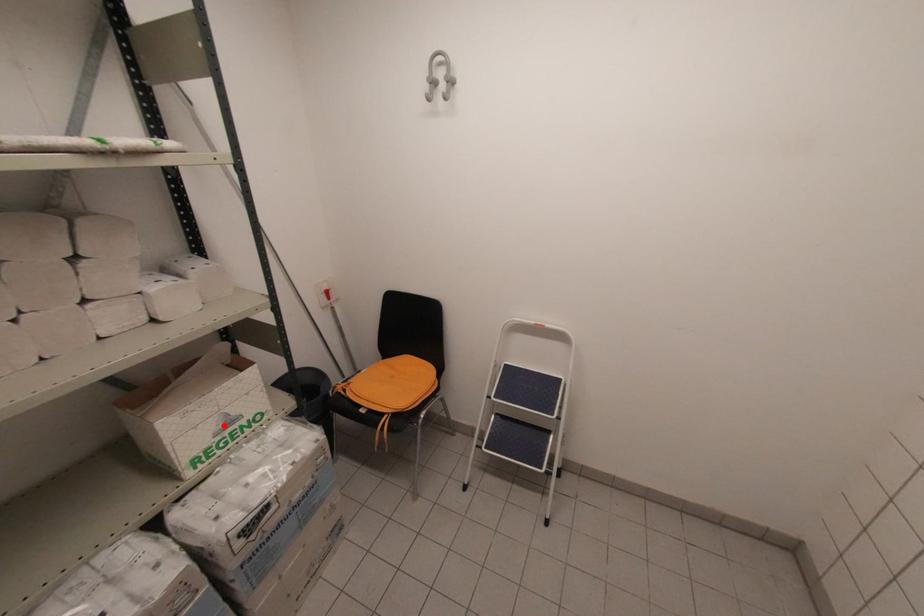
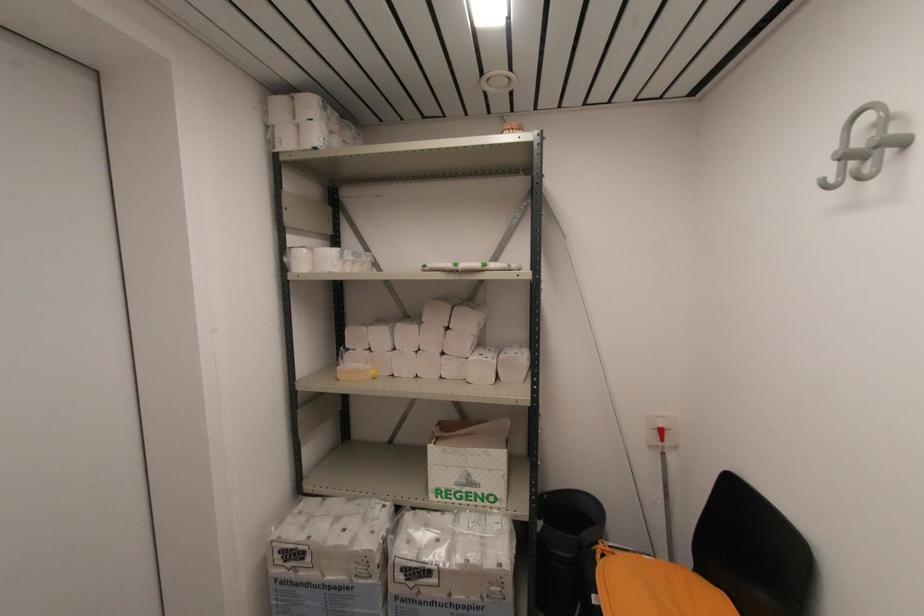
Question: I am providing you with two images of the same scene from different viewpoints. A red point is shown in image1. For the corresponding object point in image2, is it positioned nearer or farther from the camera?

Choices:
 (A) Nearer
 (B) Farther

Answer: (B)